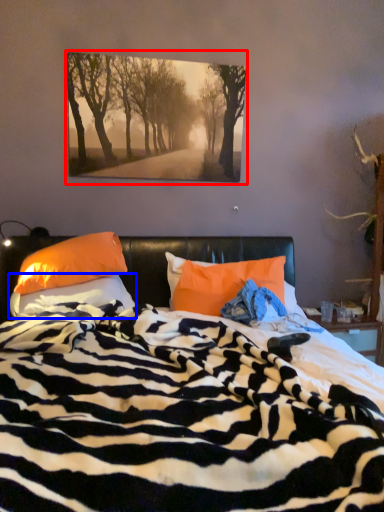
Question: Which object is further to the camera taking this photo, picture frame (highlighted by a red box) or pillow (highlighted by a blue box)?

Choices:
 (A) picture frame
 (B) pillow

Answer: (A)